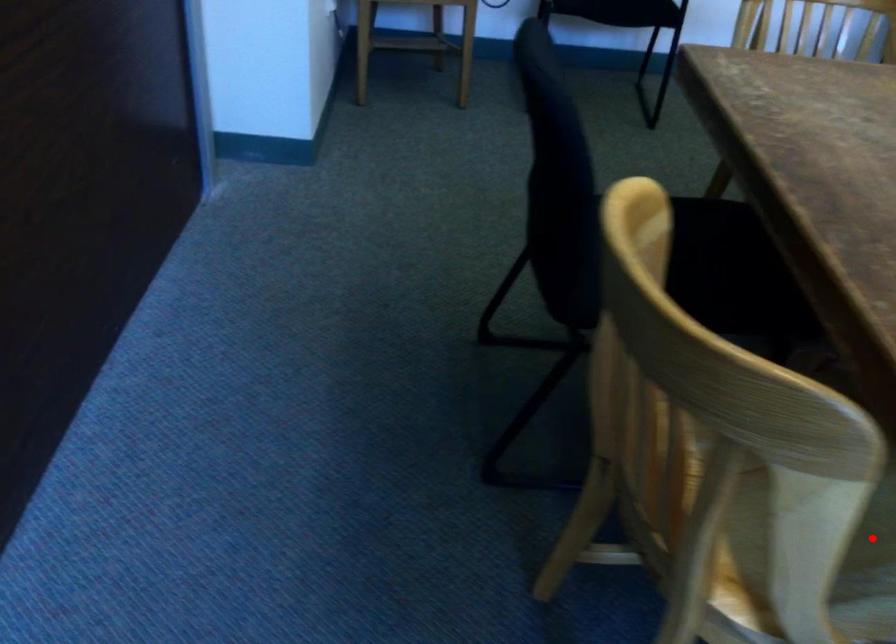
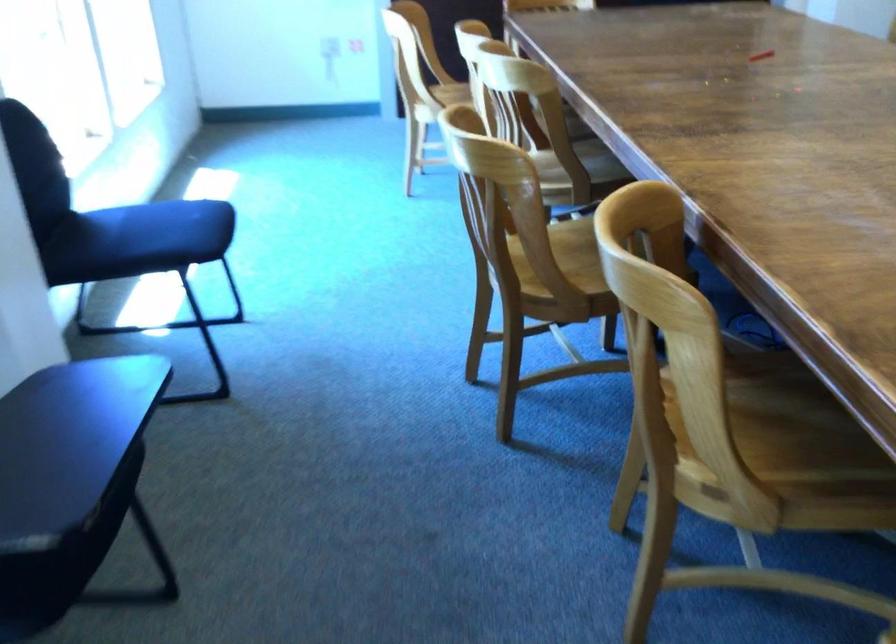
Question: I am providing you with two images of the same scene from different viewpoints. A red point is marked on the first image. At the location where the point appears in image 1, is it still visible in image 2?

Choices:
 (A) Yes
 (B) No

Answer: (B)